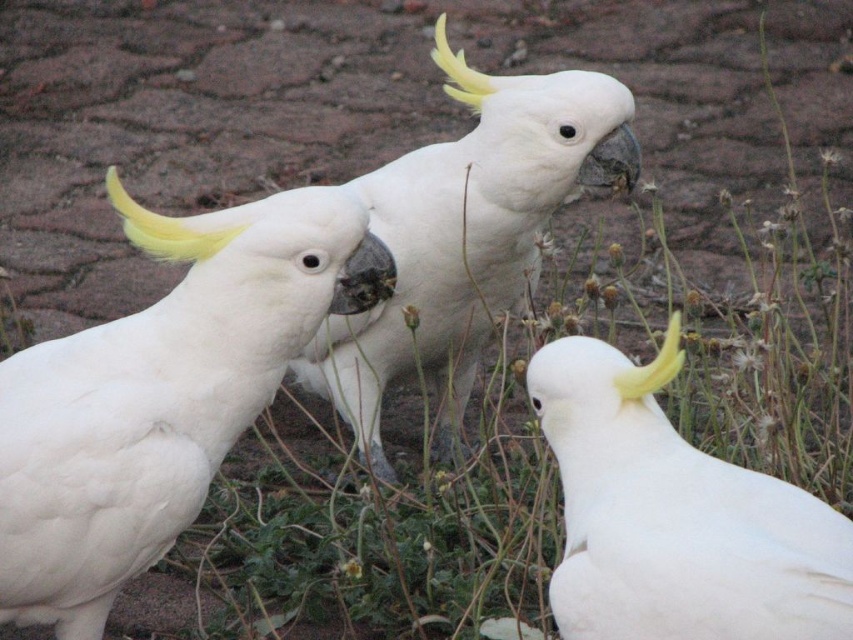
Based on the scene description, you are a wildlife photographer aiming to capture a closeup of the white feathered parrot at left and the white feathered parrot at center. Considering their sizes in the image, which parrot would require you to get closer to achieve the same level of detail in your photo?

The white feathered parrot at left occupies less space than the white feathered parrot at center, so you would need to get closer to the white feathered parrot at left to achieve the same level of detail in your photo.

You are a photographer trying to capture a clear shot of the white feathered parrot at center and the white feathered parrot at lower right. Which parrot will appear larger in your photo?

The white feathered parrot at center will appear larger because it is closer to the viewer than the white feathered parrot at lower right.